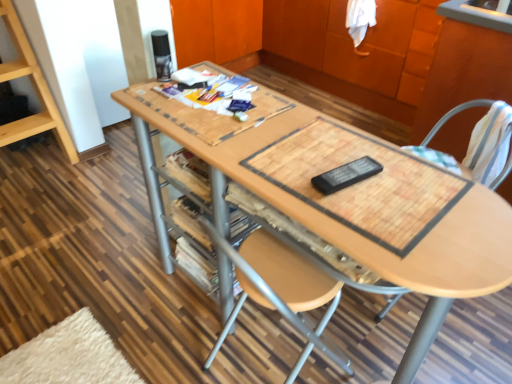
Question: Can you confirm if white striped fabric swivel chair at right is positioned to the left of wooden cabinet at upper center?

Choices:
 (A) no
 (B) yes

Answer: (A)

Question: Is white striped fabric swivel chair at right oriented away from wooden cabinet at upper center?

Choices:
 (A) yes
 (B) no

Answer: (B)

Question: Considering the relative sizes of white striped fabric swivel chair at right and wooden cabinet at upper center in the image provided, is white striped fabric swivel chair at right shorter than wooden cabinet at upper center?

Choices:
 (A) no
 (B) yes

Answer: (B)

Question: From a real-world perspective, does white striped fabric swivel chair at right sit lower than wooden cabinet at upper center?

Choices:
 (A) yes
 (B) no

Answer: (B)

Question: From the image's perspective, is white striped fabric swivel chair at right on top of wooden cabinet at upper center?

Choices:
 (A) yes
 (B) no

Answer: (B)

Question: Considering the relative sizes of white striped fabric swivel chair at right and wooden cabinet at upper center in the image provided, is white striped fabric swivel chair at right taller than wooden cabinet at upper center?

Choices:
 (A) no
 (B) yes

Answer: (A)

Question: Is white striped fabric swivel chair at right completely or partially inside wooden cabinet at upper center?

Choices:
 (A) yes
 (B) no

Answer: (B)

Question: Is wooden cabinet at upper center bigger than white striped fabric swivel chair at right?

Choices:
 (A) no
 (B) yes

Answer: (B)

Question: Is wooden cabinet at upper center at the left side of white striped fabric swivel chair at right?

Choices:
 (A) no
 (B) yes

Answer: (B)

Question: Is the position of wooden cabinet at upper center more distant than that of white striped fabric swivel chair at right?

Choices:
 (A) no
 (B) yes

Answer: (B)

Question: From the image's perspective, is wooden cabinet at upper center under white striped fabric swivel chair at right?

Choices:
 (A) no
 (B) yes

Answer: (A)

Question: From a real-world perspective, is wooden cabinet at upper center located beneath white striped fabric swivel chair at right?

Choices:
 (A) yes
 (B) no

Answer: (A)

Question: Is wooden at right thinner than wooden table at center?

Choices:
 (A) yes
 (B) no

Answer: (B)